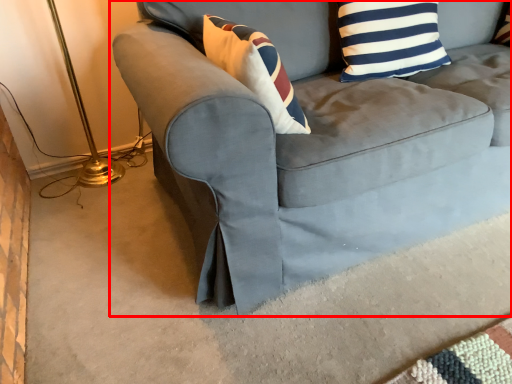
Question: From the image's perspective, what is the correct spatial positioning of studio couch (annotated by the red box) in reference to pillow?

Choices:
 (A) above
 (B) below

Answer: (B)